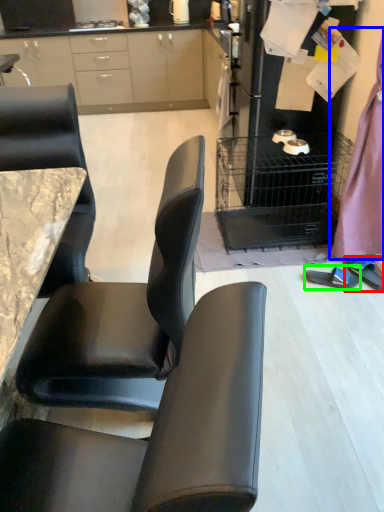
Question: Which object is the farthest from footwear (highlighted by a red box)? Choose among these: dress (highlighted by a blue box) or footwear (highlighted by a green box).

Choices:
 (A) dress
 (B) footwear

Answer: (A)